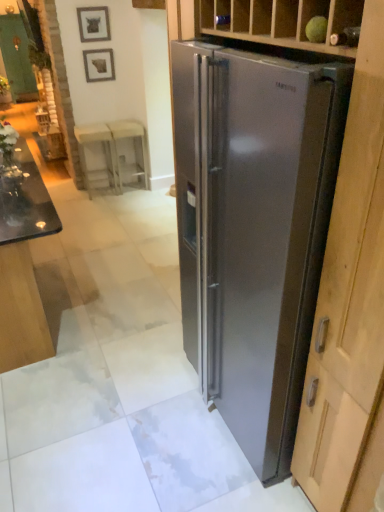
Find the location of a particular element. Image resolution: width=384 pixels, height=512 pixels. free space above white plastic stool at center, the 1th stool when ordered from left to right (from a real-world perspective) is located at coordinates (91, 127).